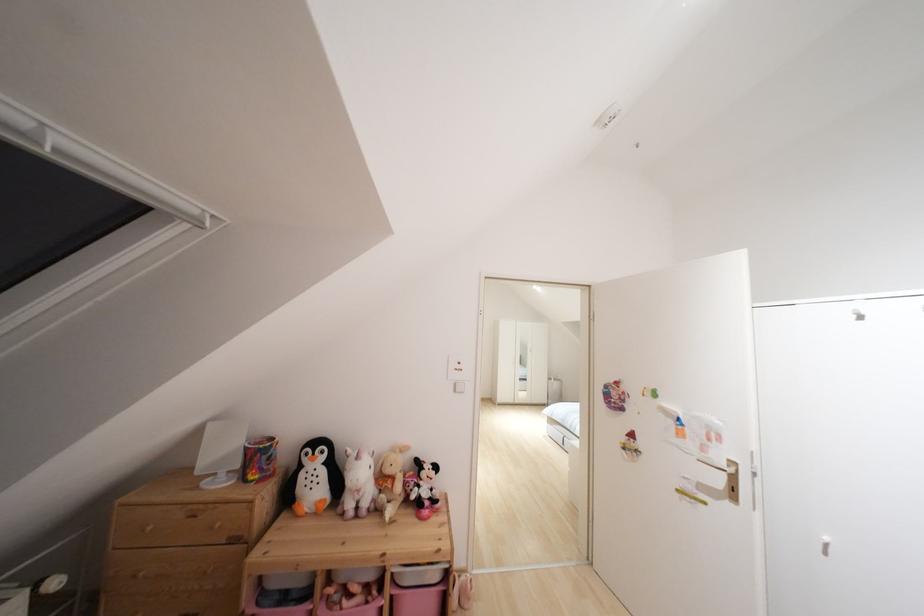
Locate an element on the screen. metal door handle is located at coordinates 720,464.